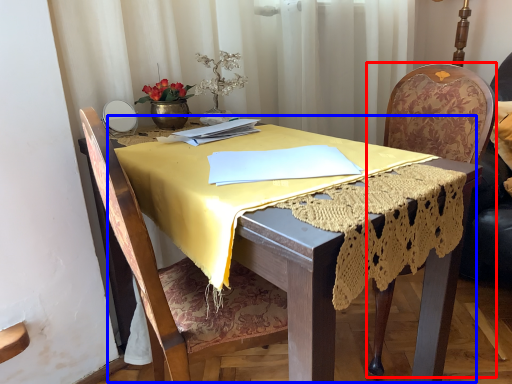
Question: Which object appears closest to the camera in this image, chair (highlighted by a red box) or round table (highlighted by a blue box)?

Choices:
 (A) chair
 (B) round table

Answer: (B)